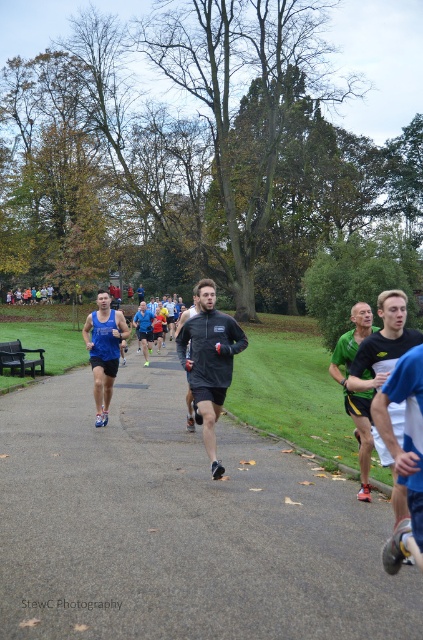
Who is more forward, [219,371] or [338,371]?

Point [338,371]

Does point (217, 358) lie in front of point (334, 374)?

That is False.

Between point (206, 339) and point (342, 355), which one is positioned behind?

Point (206, 339)

Find the location of a particular element. dark gray fleece jacket at center is located at coordinates (209, 362).

Can you confirm if dark gray fleece jacket at center is shorter than dark gray matte running shirt at center?

Indeed, dark gray fleece jacket at center has a lesser height compared to dark gray matte running shirt at center.

Which is behind, point (214, 387) or point (191, 417)?

The point (191, 417) is behind.

Which is behind, point (200, 364) or point (187, 369)?

Point (200, 364)

Image resolution: width=423 pixels, height=640 pixels. I want to click on dark gray fleece jacket at center, so click(x=209, y=362).

Can you confirm if matte blue tank top at center is positioned below dark gray matte running shirt at center?

Yes.

Who is more forward, (109, 321) or (187, 416)?

Positioned in front is point (109, 321).

What are the coordinates of `matte blue tank top at center` in the screenshot? It's located at (104, 349).